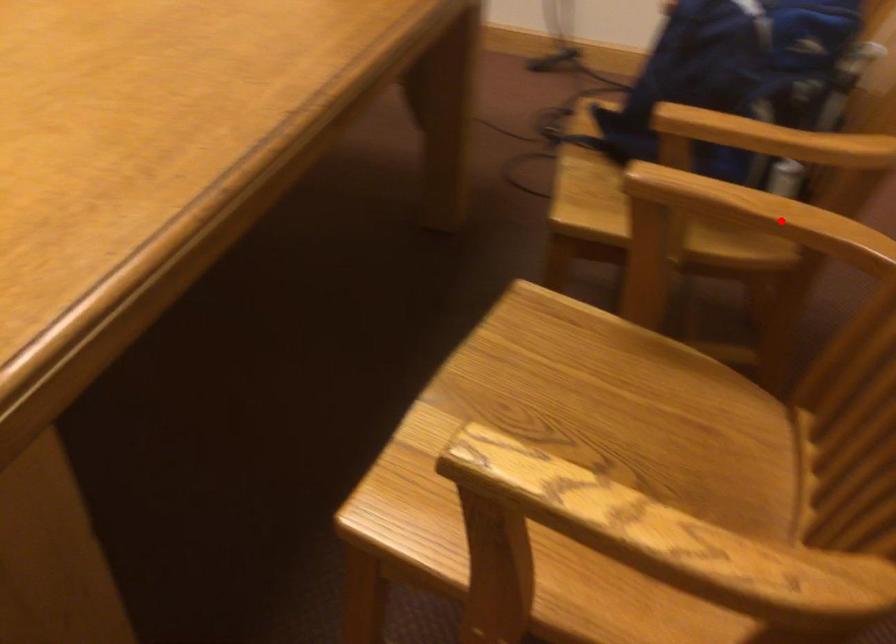
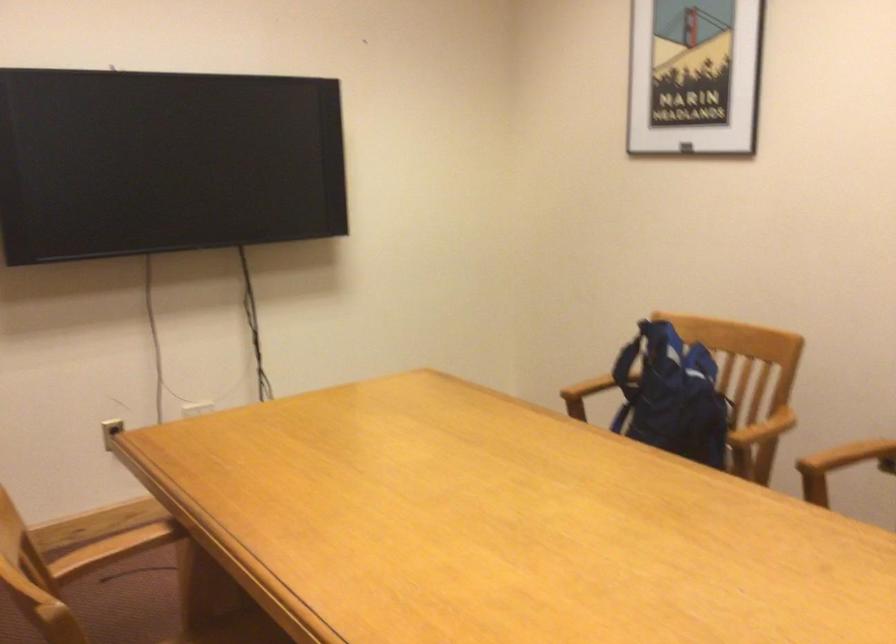
In the second image, find the point that corresponds to the highlighted location in the first image.

(849, 456)